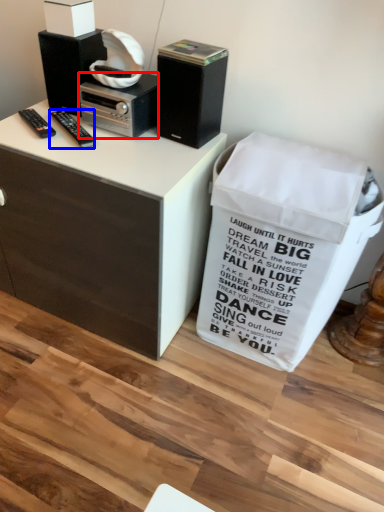
Question: Which of the following is the closest to the observer, appliance (highlighted by a red box) or remote control (highlighted by a blue box)?

Choices:
 (A) appliance
 (B) remote control

Answer: (B)